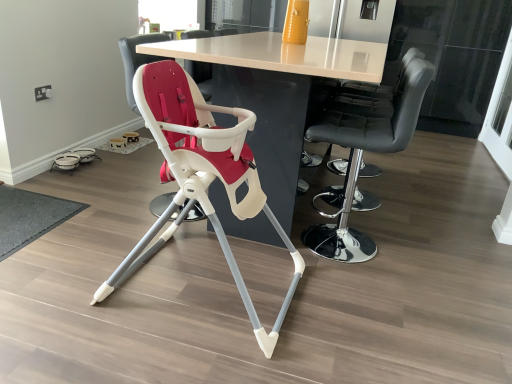
Where is `vacant space to the left of matte plastic highchair at center, the second chair viewed from the left`? This screenshot has width=512, height=384. vacant space to the left of matte plastic highchair at center, the second chair viewed from the left is located at coordinates (70, 271).